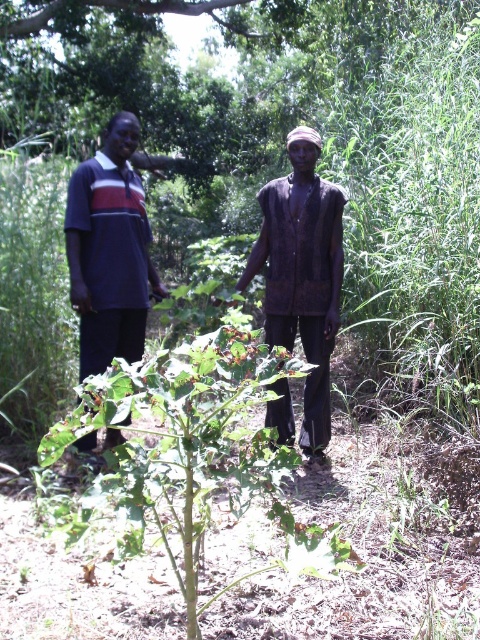
Question: Among these objects, which one is nearest to the camera?

Choices:
 (A) dark brown fabric at center
 (B) dark blue jersey at left
 (C) green leafy plant at center

Answer: (C)

Question: Is green leafy plant at center wider than dark blue jersey at left?

Choices:
 (A) yes
 (B) no

Answer: (A)

Question: Which object appears farthest from the camera in this image?

Choices:
 (A) green leafy plant at center
 (B) dark brown fabric at center
 (C) dark blue jersey at left

Answer: (B)

Question: Which of the following is the closest to the observer?

Choices:
 (A) dark blue jersey at left
 (B) dark brown fabric at center
 (C) green leafy plant at center

Answer: (C)

Question: Is green leafy plant at center thinner than dark blue jersey at left?

Choices:
 (A) yes
 (B) no

Answer: (B)

Question: Can you confirm if dark brown fabric at center is thinner than dark blue jersey at left?

Choices:
 (A) yes
 (B) no

Answer: (B)